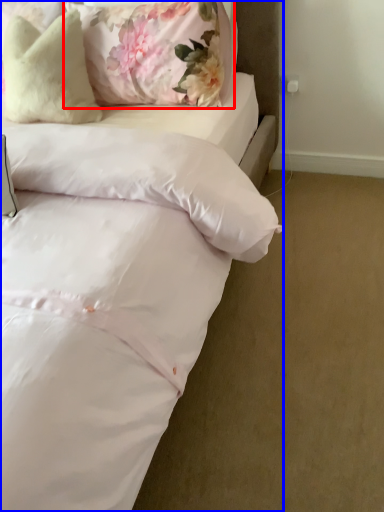
Question: Which point is further to the camera, pillow (highlighted by a red box) or bed (highlighted by a blue box)?

Choices:
 (A) pillow
 (B) bed

Answer: (A)